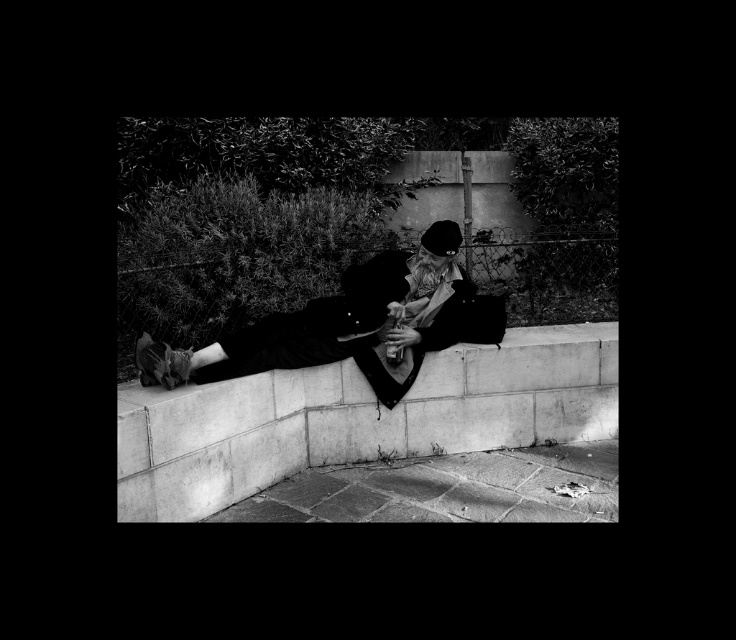
Describe the element at coordinates (358, 419) in the screenshot. I see `concrete at lower center` at that location.

Measure the distance between concrete at lower center and camera.

concrete at lower center and camera are 7.88 feet apart.

Image resolution: width=736 pixels, height=640 pixels. I want to click on concrete at lower center, so click(358, 419).